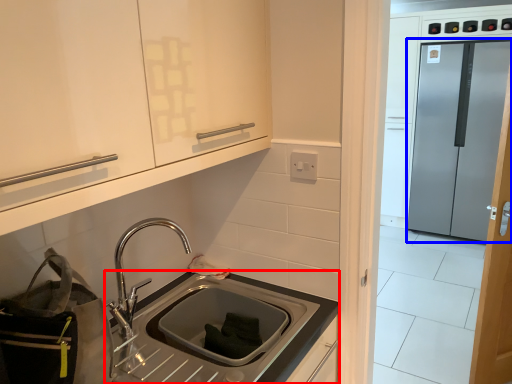
Question: Which object is further to the camera taking this photo, countertop (highlighted by a red box) or glass door (highlighted by a blue box)?

Choices:
 (A) countertop
 (B) glass door

Answer: (B)